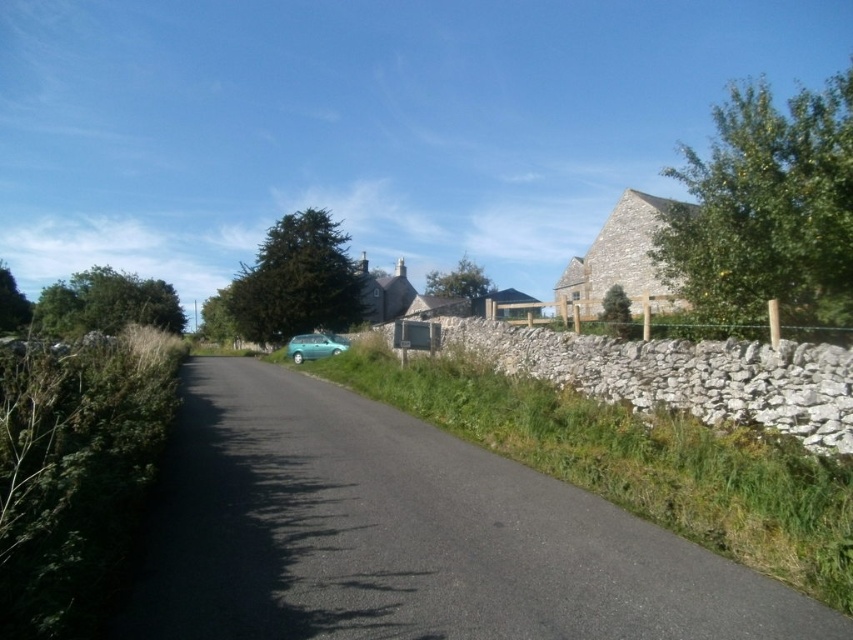
Is asphalt road at center thinner than teal matte hatchback at center?

Yes.

Consider the image. Who is positioned more to the left, asphalt road at center or teal matte hatchback at center?

teal matte hatchback at center is more to the left.

Image resolution: width=853 pixels, height=640 pixels. I want to click on asphalt road at center, so click(x=407, y=536).